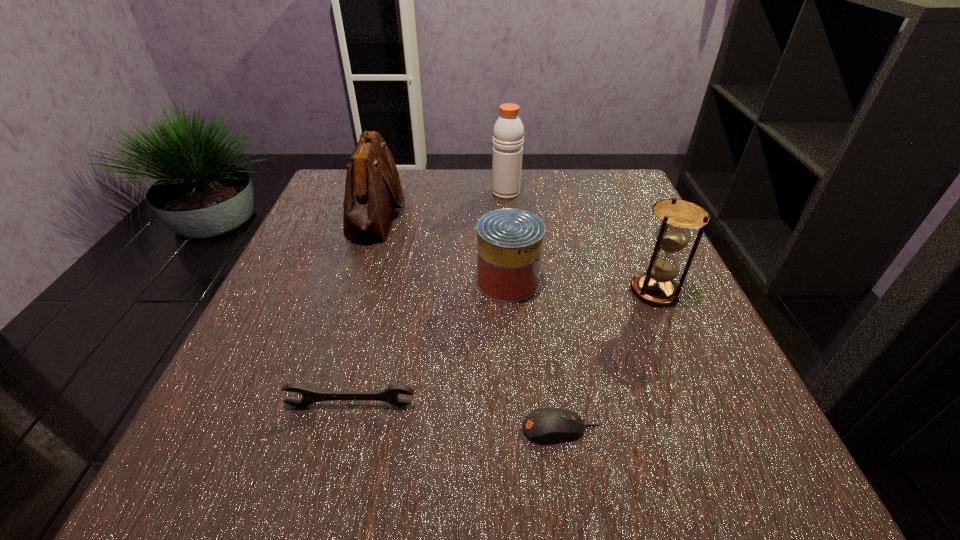
At what (x,y) coordinates should I click in order to perform the action: click on vacant space located 0.300m on the back of the rightmost object. Please return your answer as a coordinate pair (x, y). The image size is (960, 540). Looking at the image, I should click on (612, 195).

The width and height of the screenshot is (960, 540). Identify the location of free space located 0.050m on the front of the third shortest object. (511, 323).

Where is `free spot located 0.090m on the open ends of the second shortest object`? The height and width of the screenshot is (540, 960). free spot located 0.090m on the open ends of the second shortest object is located at coordinates (334, 468).

Where is `free space located on the left of the computer mouse`? The width and height of the screenshot is (960, 540). free space located on the left of the computer mouse is located at coordinates (407, 429).

Where is `shaker that is at the far edge`? shaker that is at the far edge is located at coordinates (508, 133).

Find the location of a particular element. shoulder bag at the far edge is located at coordinates (372, 189).

Locate an element on the screen. object that is at the near edge is located at coordinates (548, 424).

This screenshot has width=960, height=540. What are the coordinates of `shoulder bag that is positioned at the left edge` in the screenshot? It's located at (372, 189).

This screenshot has width=960, height=540. Find the location of `wrench at the left edge`. wrench at the left edge is located at coordinates (389, 395).

Locate an element on the screen. object situated at the right edge is located at coordinates (656, 286).